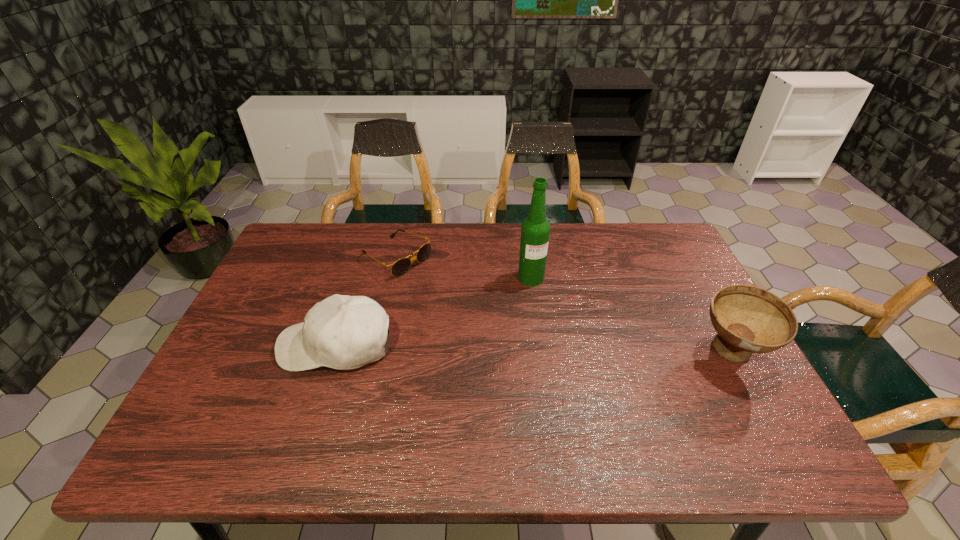
The width and height of the screenshot is (960, 540). I want to click on free space located on the label of the second object from right to left, so click(x=596, y=387).

Where is `vacant space situated 0.240m on the label of the second object from right to left`? vacant space situated 0.240m on the label of the second object from right to left is located at coordinates (572, 346).

You are a GUI agent. You are given a task and a screenshot of the screen. Output one action in this format:
    pyautogui.click(x=<x>, y=<y>)
    Task: Click on the free space located 0.100m on the lenses of the sunglasses
    Image resolution: width=960 pixels, height=540 pixels.
    Given the screenshot: What is the action you would take?
    pyautogui.click(x=444, y=287)

You are a GUI agent. You are given a task and a screenshot of the screen. Output one action in this format:
    pyautogui.click(x=<x>, y=<y>)
    Task: Click on the vacant area situated 0.330m on the lenses of the sunglasses
    
    Given the screenshot: What is the action you would take?
    tap(504, 326)

At what (x,y) coordinates should I click in order to perform the action: click on vacant space located 0.380m on the lenses of the sunglasses. Please return your answer as a coordinate pair (x, y). The height and width of the screenshot is (540, 960). Looking at the image, I should click on (518, 335).

Image resolution: width=960 pixels, height=540 pixels. I want to click on object that is at the far edge, so click(x=400, y=267).

At what (x,y) coordinates should I click in order to perform the action: click on object that is at the left edge. Please return your answer as a coordinate pair (x, y). Looking at the image, I should click on (342, 332).

This screenshot has width=960, height=540. I want to click on object at the right edge, so (x=748, y=319).

In the image, there is a desktop. At what (x,y) coordinates should I click in order to perform the action: click on blank space at the far edge. Please return your answer as a coordinate pair (x, y). This screenshot has height=540, width=960. Looking at the image, I should click on (345, 228).

At what (x,y) coordinates should I click in order to perform the action: click on vacant space at the near edge of the desktop. Please return your answer as a coordinate pair (x, y). The image size is (960, 540). Looking at the image, I should click on (618, 420).